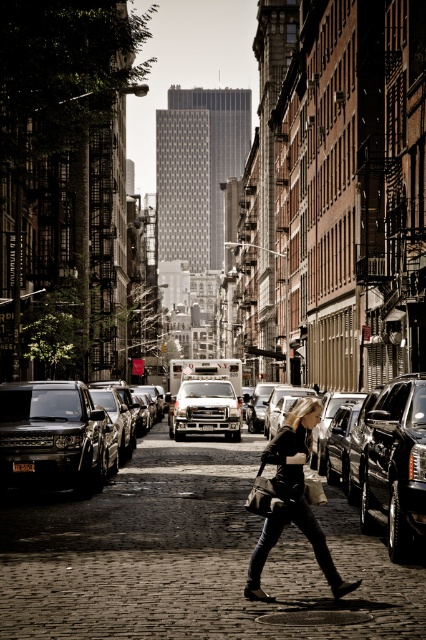
Question: Does shiny black suv at left appear under white matte van at center?

Choices:
 (A) yes
 (B) no

Answer: (B)

Question: Does shiny black suv at left appear over shiny black suv at right?

Choices:
 (A) no
 (B) yes

Answer: (B)

Question: Which point appears farthest from the camera in this image?

Choices:
 (A) (81, 435)
 (B) (249, 592)
 (C) (224, 381)

Answer: (C)

Question: Which is farther from the white matte van at center?

Choices:
 (A) shiny black suv at right
 (B) shiny black suv at left
 (C) black leather jacket at center

Answer: (C)

Question: Which point is closer to the camera?

Choices:
 (A) shiny black suv at left
 (B) white matte van at center
 (C) black leather jacket at center
 (D) shiny black suv at right

Answer: (C)

Question: Is the position of shiny black suv at left less distant than that of white matte van at center?

Choices:
 (A) yes
 (B) no

Answer: (A)